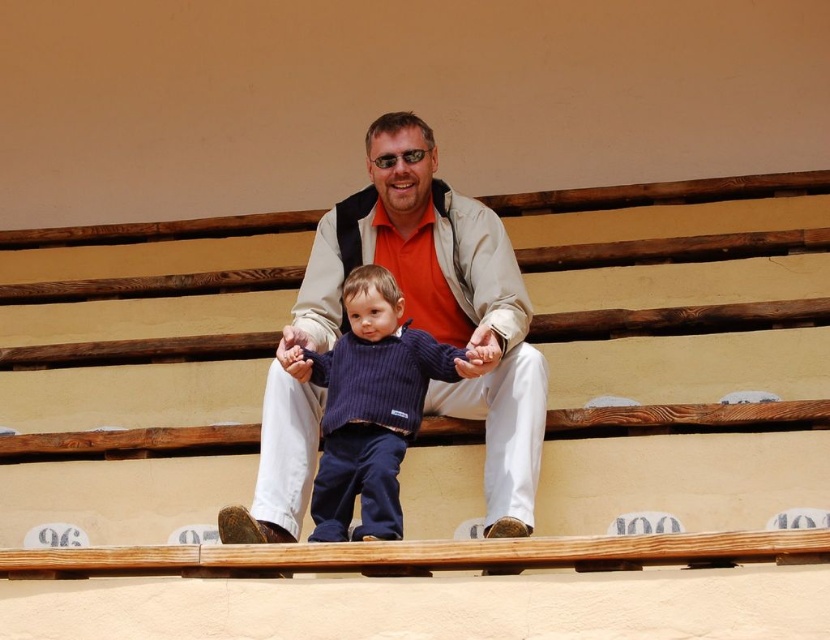
Is wooden at center to the left of matte beige jacket at center from the viewer's perspective?

Incorrect, wooden at center is not on the left side of matte beige jacket at center.

Can you confirm if wooden at center is positioned to the right of matte beige jacket at center?

Correct, you'll find wooden at center to the right of matte beige jacket at center.

Does point (641, 300) come behind point (396, 193)?

That is True.

Identify the location of wooden at center. (433, 417).

Is wooden at center shorter than dark blue ribbed sweater at center?

No.

Where is `wooden at center`? wooden at center is located at coordinates (433, 417).

Does matte beige jacket at center lie in front of dark blue ribbed sweater at center?

Yes.

Measure the distance between point (392, 154) and camera.

The distance of point (392, 154) from camera is 142.13 feet.

Locate an element on the screen. Image resolution: width=830 pixels, height=640 pixels. matte beige jacket at center is located at coordinates (413, 326).